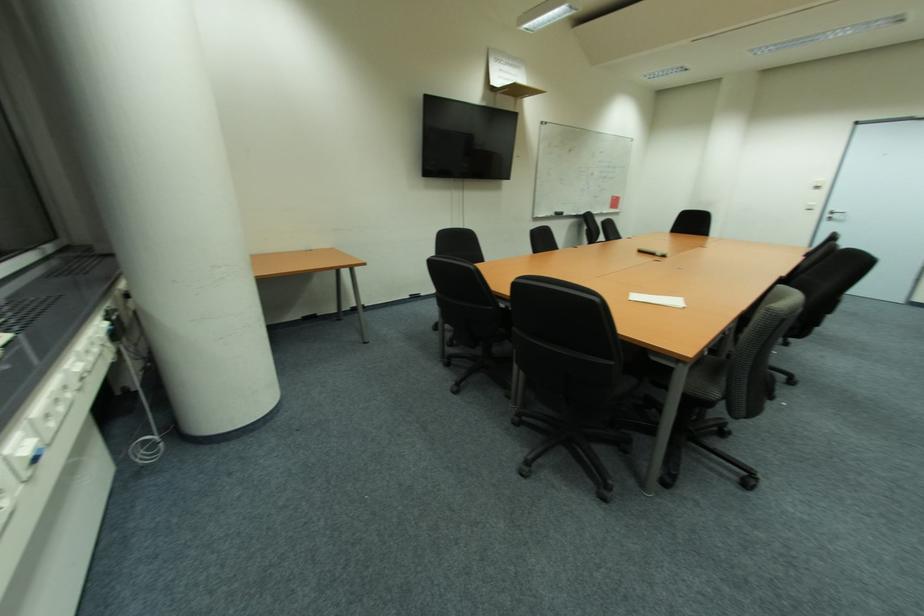
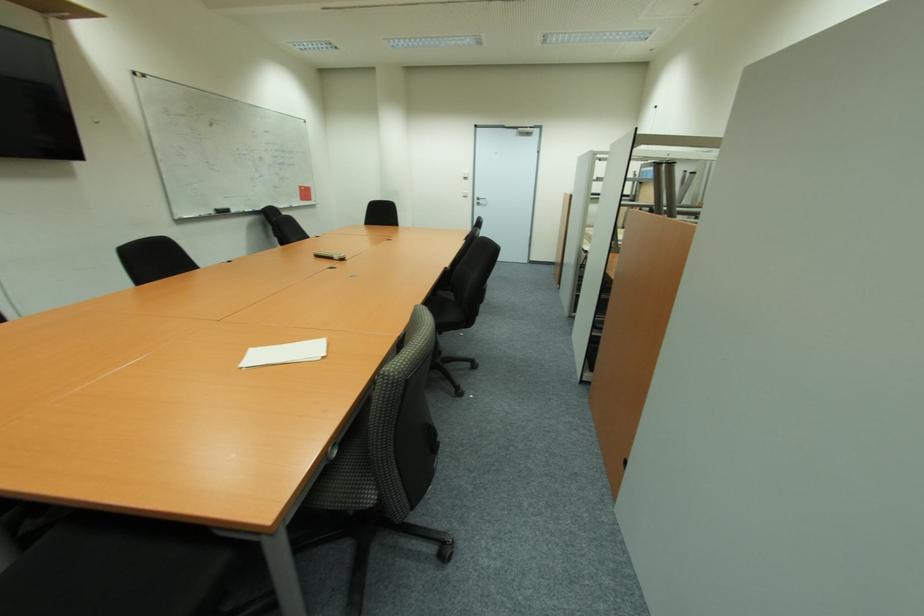
Where in the second image is the point corresponding to (x=842, y=217) from the first image?

(483, 203)